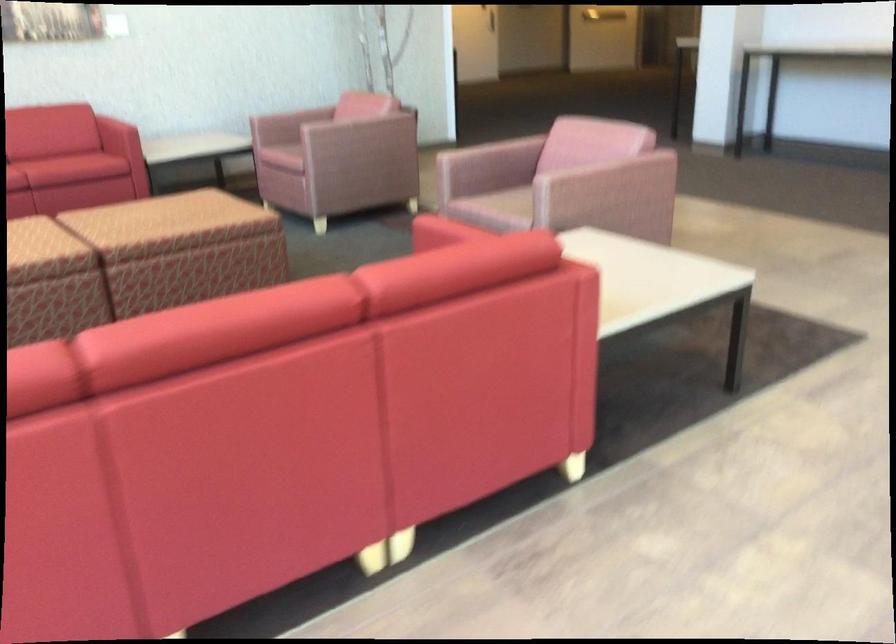
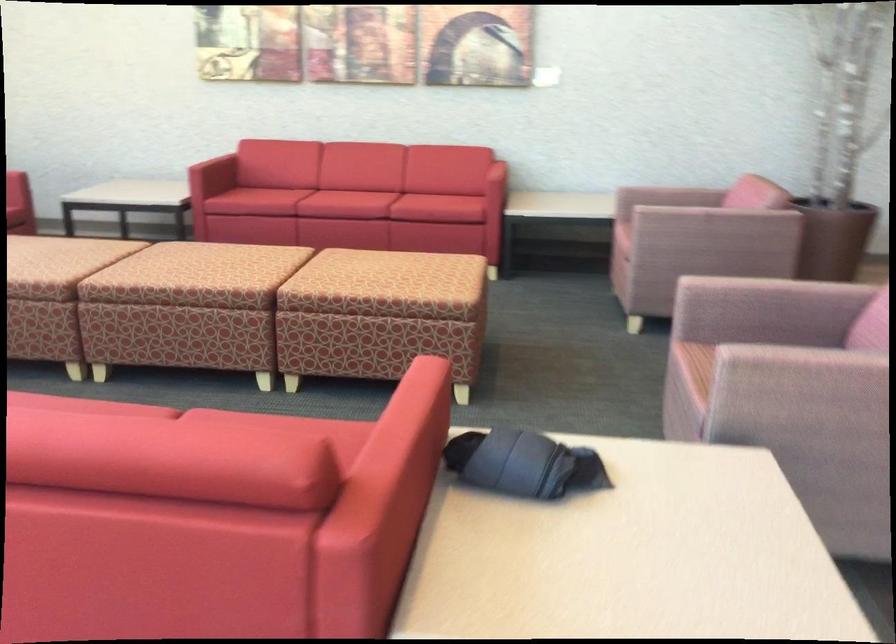
The point at (280, 134) is marked in the first image. Where is the corresponding point in the second image?

(624, 218)